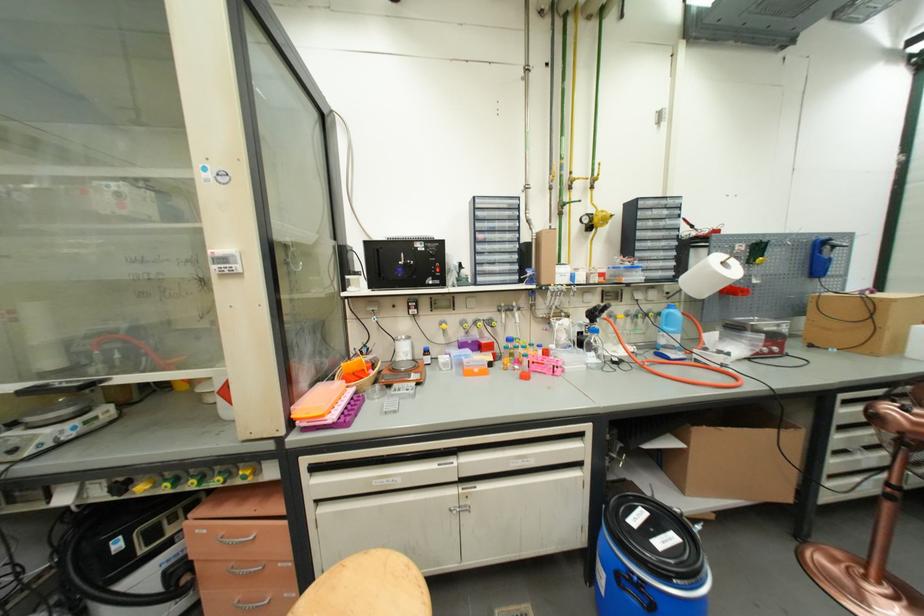
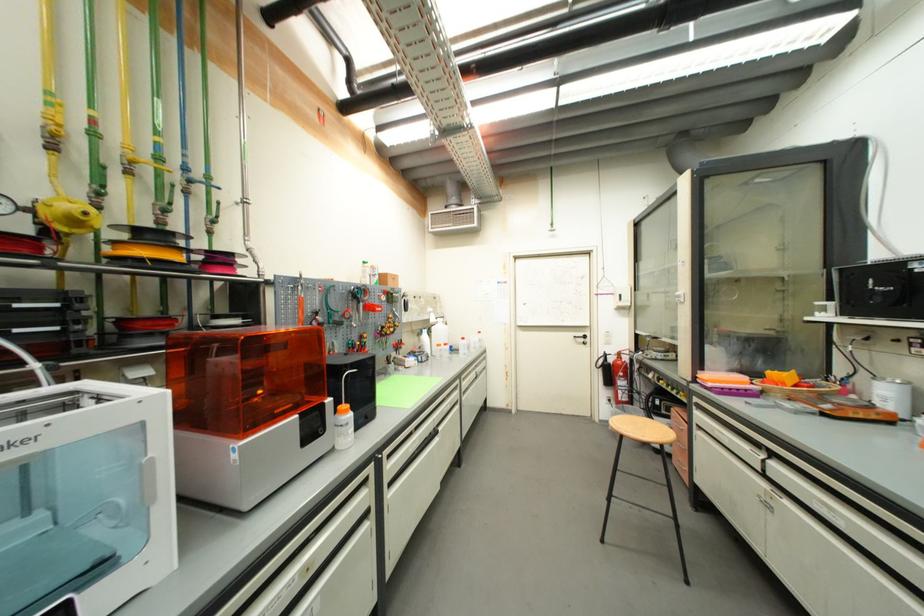
In the second image, find the point that corresponds to pixel 296 424 in the first image.

(699, 379)